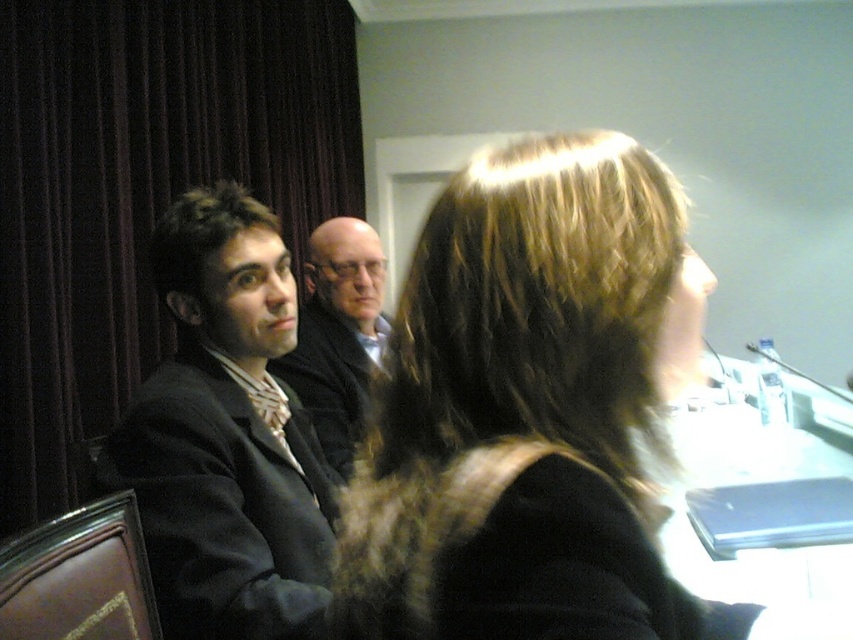
In the scene shown: You are a photographer setting up for a group photo in the conference room. You notice the matte black suit at left and the dark brown textured hair at left. Which object should you adjust to ensure both are fully visible in the frame?

The matte black suit at left is taller than dark brown textured hair at left, so you should adjust the matte black suit at left to lower its height to ensure both are fully visible in the frame.

You are a photographer trying to capture a clear shot of the dark brown textured hair at left without the dark velvet curtain at left obstructing it. Is the curtain currently blocking the view of the hair?

The dark velvet curtain at left is positioned over dark brown textured hair at left, so yes, the curtain is blocking the view of the hair.